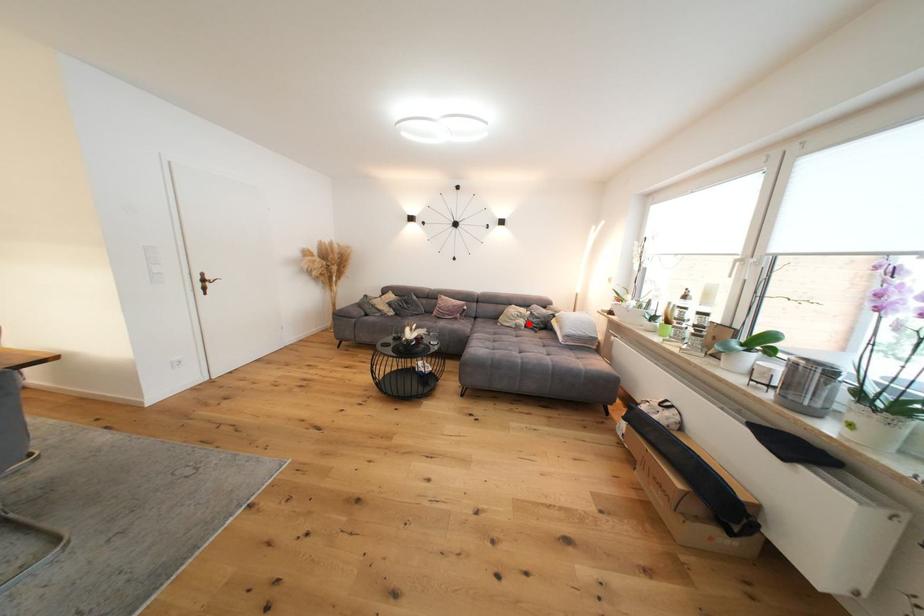
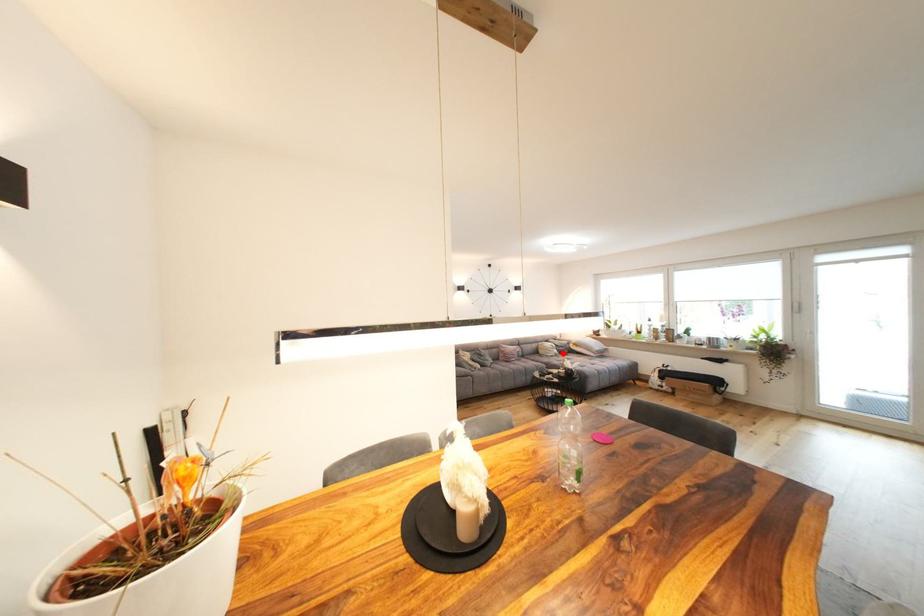
I am providing you with two images of the same scene from different viewpoints. A red point is marked on the first image and another point is marked on the second image. Does the point marked in image1 correspond to the same location as the one in image2?

Yes